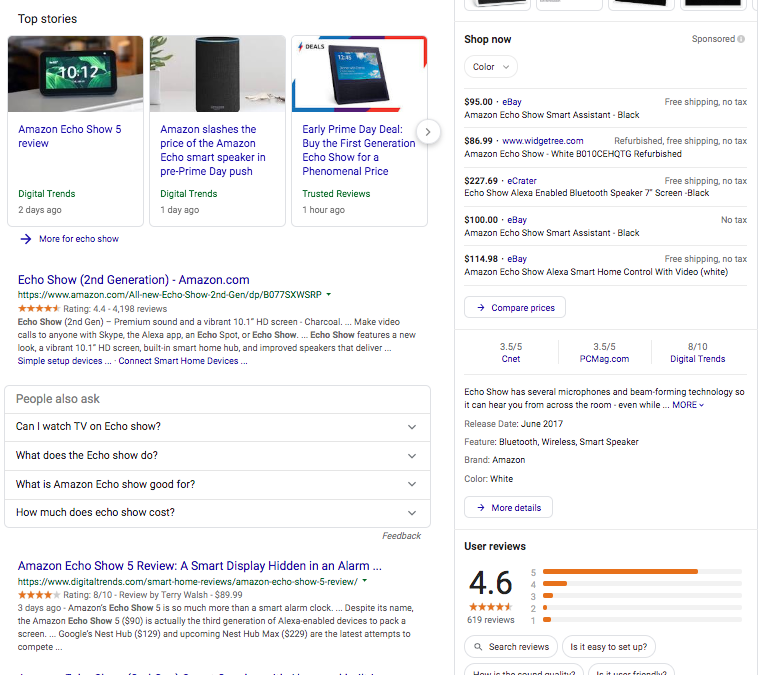
Locate an element on the screen. Image resolution: width=775 pixels, height=675 pixels. amazon echo is located at coordinates (217, 73).